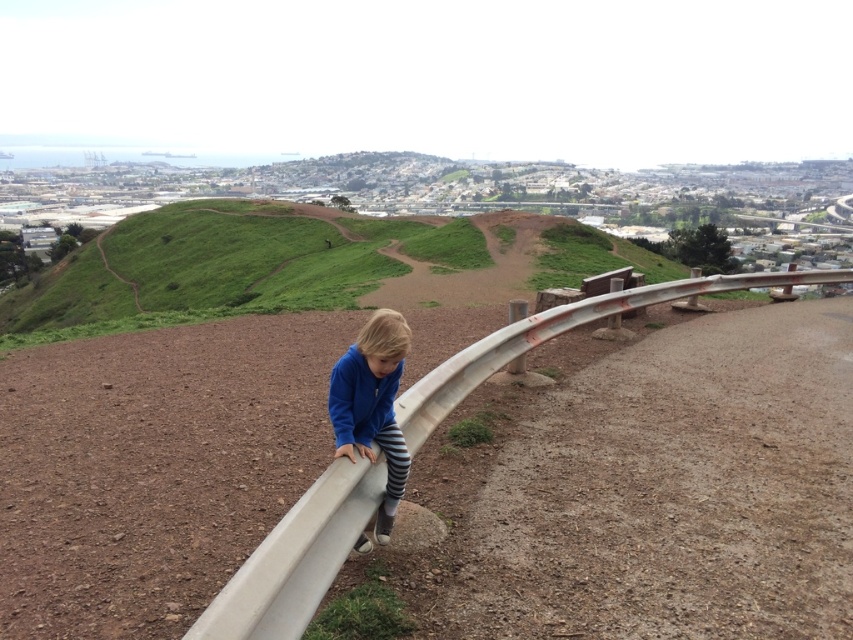
Question: Which point is closer to the camera?

Choices:
 (A) white matte rail at center
 (B) blue fleece jacket at center

Answer: (A)

Question: Does white matte rail at center have a lesser width compared to blue fleece jacket at center?

Choices:
 (A) no
 (B) yes

Answer: (A)

Question: Does white matte rail at center appear on the right side of blue fleece jacket at center?

Choices:
 (A) no
 (B) yes

Answer: (B)

Question: Is white matte rail at center below blue fleece jacket at center?

Choices:
 (A) yes
 (B) no

Answer: (B)